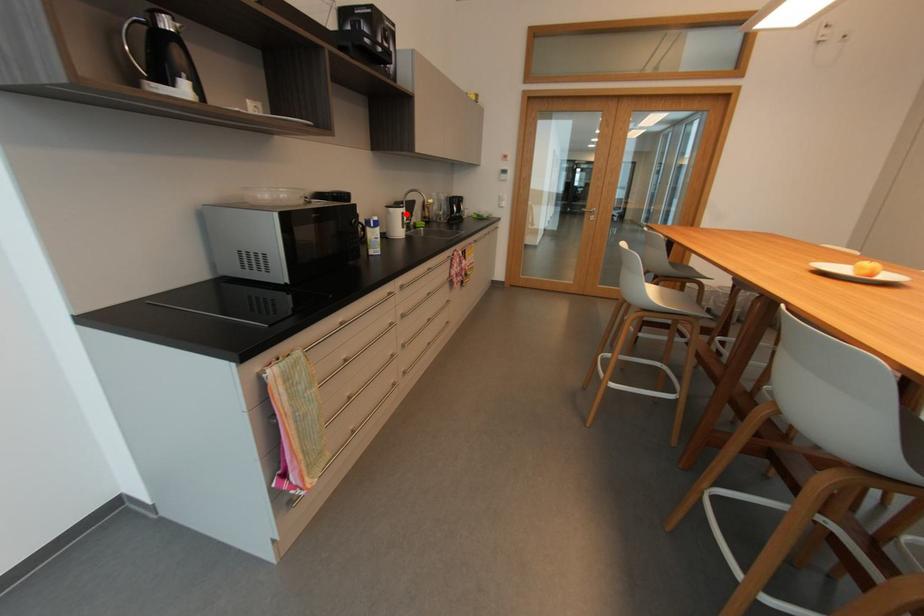
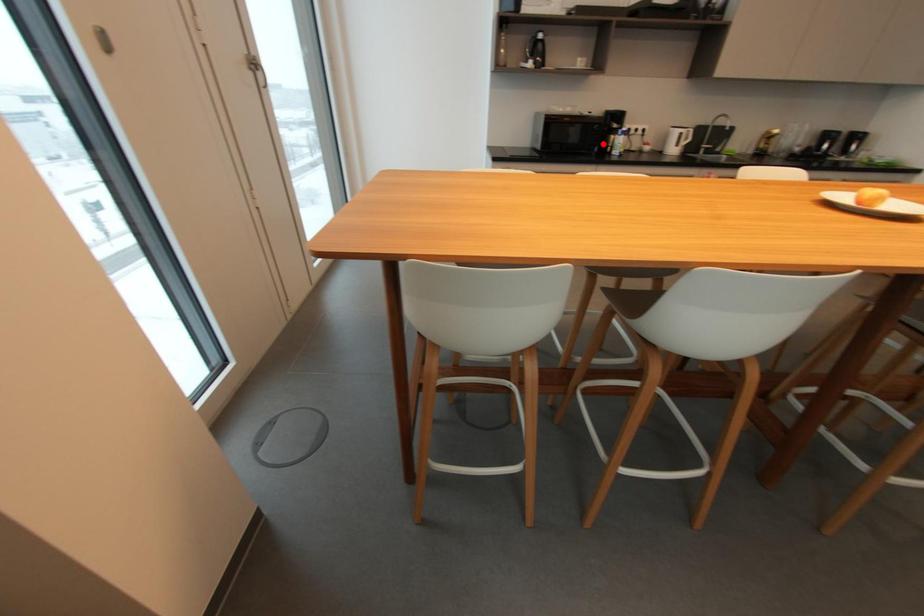
I am providing you with two images of the same scene from different viewpoints. A red point is marked on the first image and another point is marked on the second image. Are the points marked in image1 and image2 representing the same 3D position?

No